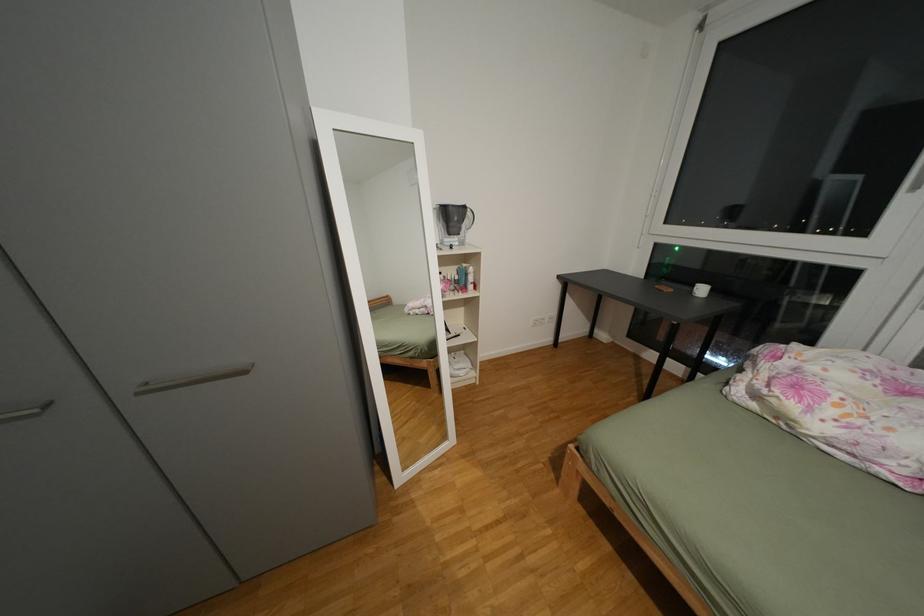
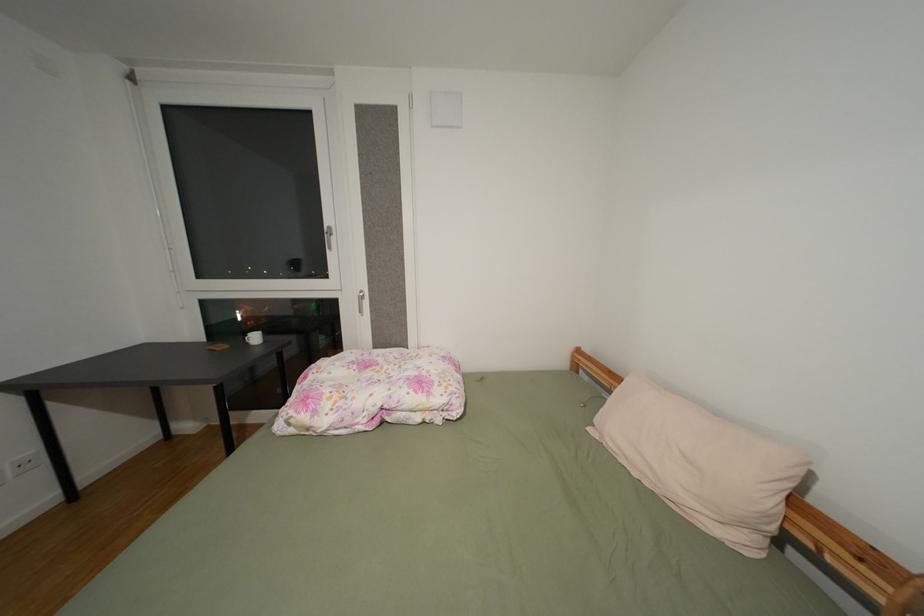
Question: Based on the continuous images, in which direction is the camera rotating? Reply with the corresponding letter.

Choices:
 (A) Left
 (B) Right
 (C) Up
 (D) Down

Answer: (B)